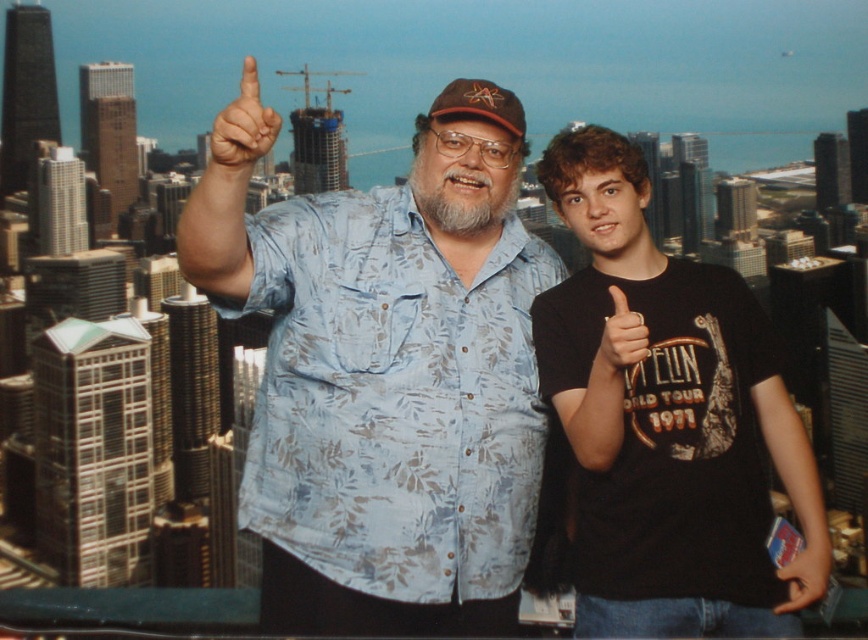
Question: Is the position of black t-shirt at right more distant than that of matte black hand at lower right?

Choices:
 (A) no
 (B) yes

Answer: (A)

Question: In this image, where is black t-shirt at right located relative to matte black thumb at center?

Choices:
 (A) left
 (B) right

Answer: (B)

Question: Is matte black thumb at center positioned at the back of matte black hand at lower right?

Choices:
 (A) yes
 (B) no

Answer: (A)

Question: Which object appears farthest from the camera in this image?

Choices:
 (A) matte blue shirt at upper center
 (B) blue floral shirt at center

Answer: (A)

Question: Which point appears farthest from the camera in this image?

Choices:
 (A) (668, 492)
 (B) (456, 568)
 (C) (625, 330)
 (D) (240, 172)

Answer: (C)

Question: Among these points, which one is nearest to the camera?

Choices:
 (A) (779, 568)
 (B) (224, 141)

Answer: (A)